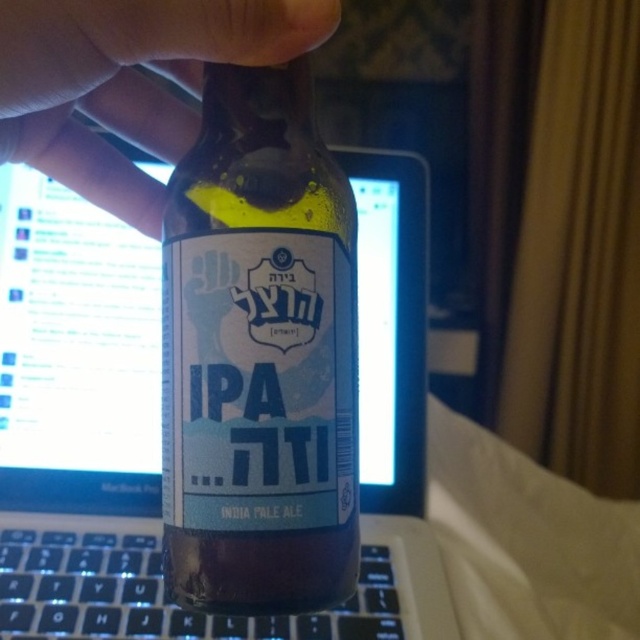
You are organizing a photo shoot and need to place the matte skin at upper left and black plastic keyboard at lower left in a way that fits within a 120 cm wide backdrop. Given their widths, can both items fit side by side without overlapping?

The matte skin at upper left has a smaller width than the black plastic keyboard at lower left. However, without knowing the exact widths of both items, it is impossible to determine if they can fit side by side within the 120 cm backdrop.

You are organizing a desk and need to place a laptop and keyboard. Based on the scene, where should you position the black plastic keyboard at lower left relative to the glossy plastic computer screen at center to match the original setup?

The glossy plastic computer screen at center is above the black plastic keyboard at lower left, so to match the original setup, position the black plastic keyboard at lower left below the glossy plastic computer screen at center.